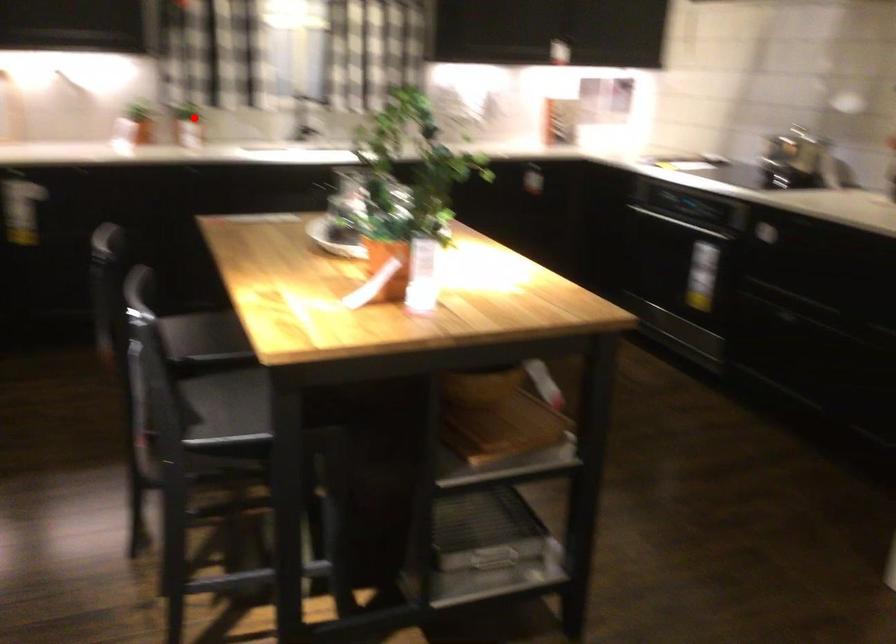
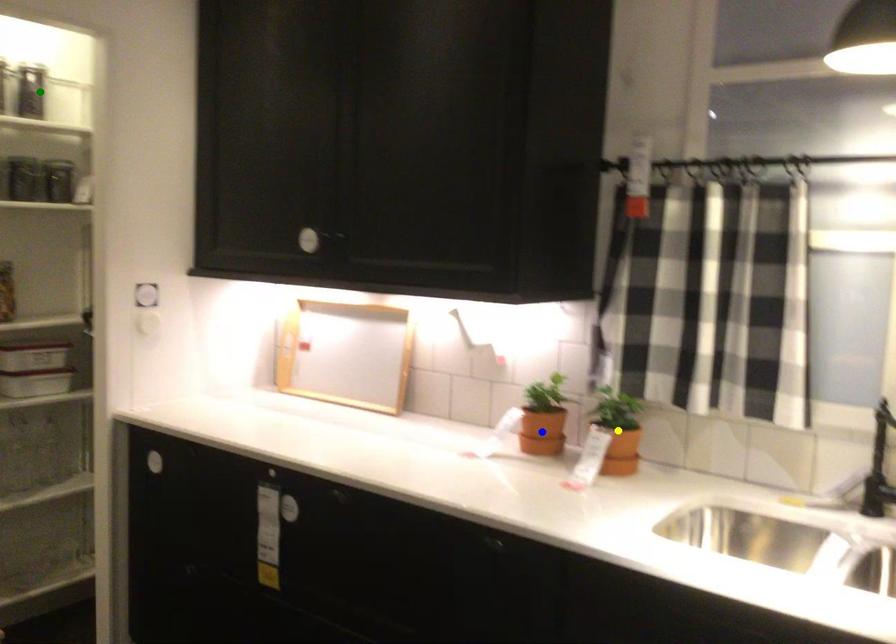
Question: I am providing you with two images of the same scene from different viewpoints. A red point is marked on the first image. You are given multiple points on the second image. Which point in image 2 is actually the same real-world point as the red point in image 1?

Choices:
 (A) green point
 (B) yellow point
 (C) blue point

Answer: (B)